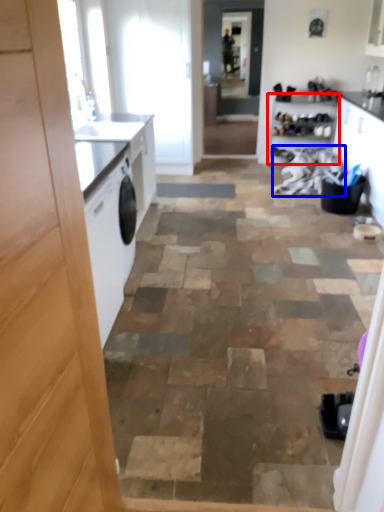
Question: Which object is closer to the camera taking this photo, cabinetry (highlighted by a red box) or laundry (highlighted by a blue box)?

Choices:
 (A) cabinetry
 (B) laundry

Answer: (B)